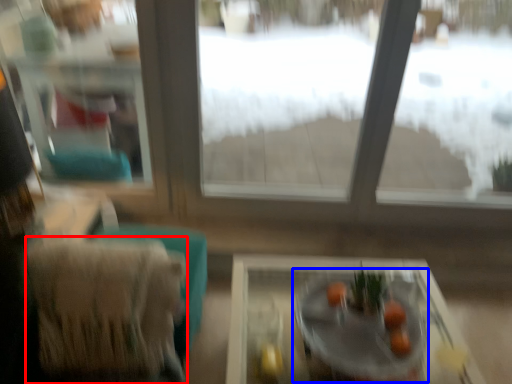
Question: Among these objects, which one is farthest to the camera, armchair (highlighted by a red box) or round table (highlighted by a blue box)?

Choices:
 (A) armchair
 (B) round table

Answer: (A)